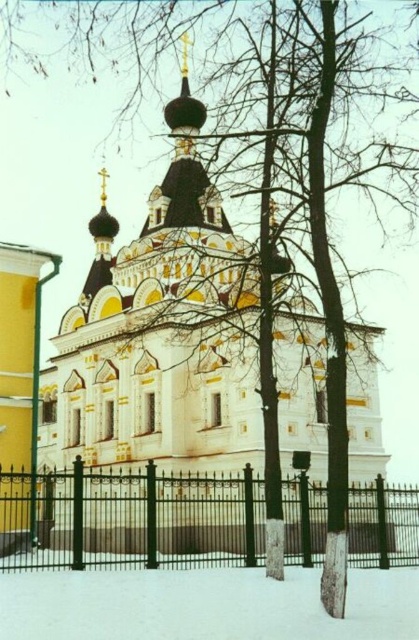
Between black metal fence at lower left and white powdery snow at lower center, which one is positioned higher?

Positioned higher is white powdery snow at lower center.

Does black metal fence at lower left have a larger size compared to white powdery snow at lower center?

Correct, black metal fence at lower left is larger in size than white powdery snow at lower center.

Who is more distant from viewer, (x=121, y=500) or (x=392, y=612)?

Point (x=121, y=500)

Image resolution: width=419 pixels, height=640 pixels. I want to click on black metal fence at lower left, so click(x=129, y=518).